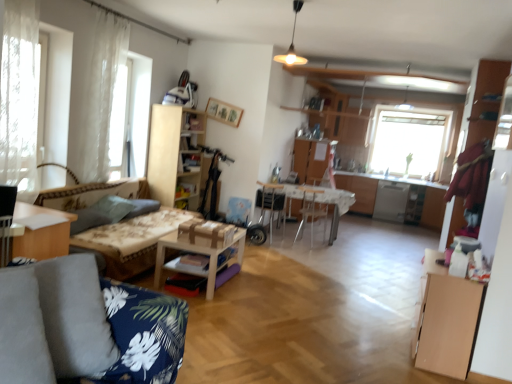
Image resolution: width=512 pixels, height=384 pixels. I want to click on empty space that is ontop of white sheer curtain at left, so click(116, 10).